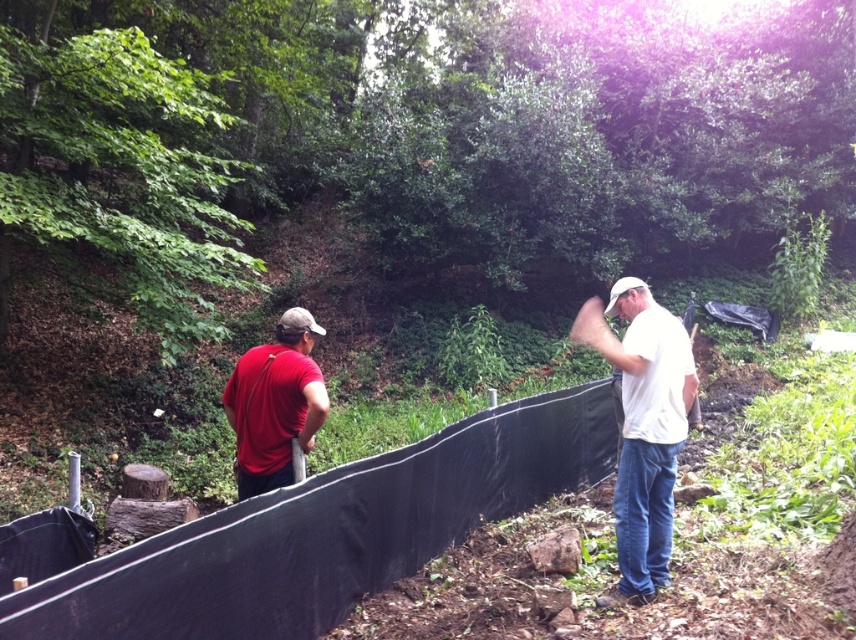
Question: Considering the real-world distances, which object is farthest from the matte red shirt at left?

Choices:
 (A) white matte shirt at right
 (B) black plastic fence at center

Answer: (A)

Question: Does black plastic fence at center appear over matte red shirt at left?

Choices:
 (A) no
 (B) yes

Answer: (A)

Question: Observing the image, what is the correct spatial positioning of black plastic fence at center in reference to matte red shirt at left?

Choices:
 (A) right
 (B) left

Answer: (A)

Question: Among these points, which one is farthest from the camera?

Choices:
 (A) (288, 353)
 (B) (539, 422)
 (C) (614, 310)

Answer: (B)

Question: Does white matte shirt at right have a lesser width compared to matte red shirt at left?

Choices:
 (A) no
 (B) yes

Answer: (A)

Question: Which object is positioned closest to the black plastic fence at center?

Choices:
 (A) white matte shirt at right
 (B) matte red shirt at left

Answer: (B)